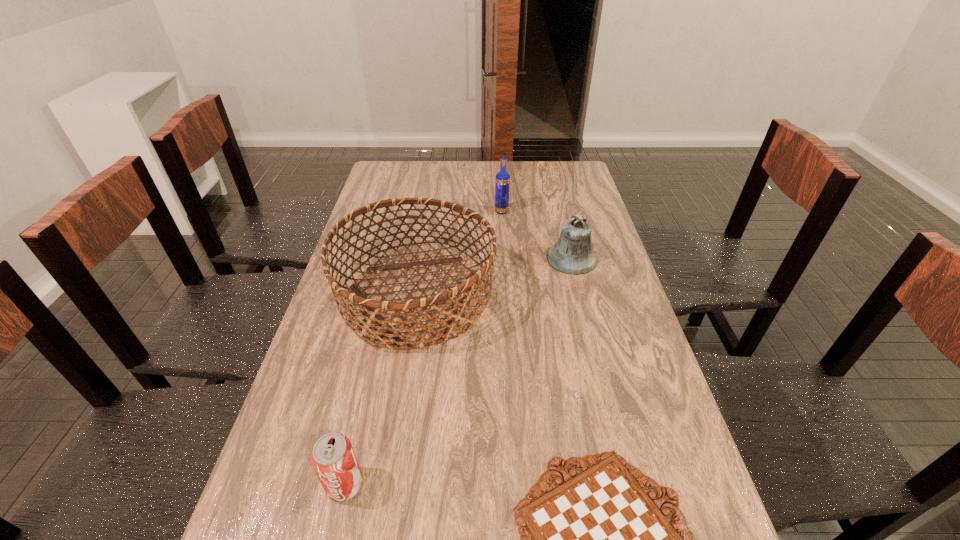
Find the location of `object positioned at the right edge`. object positioned at the right edge is located at coordinates (572, 254).

The height and width of the screenshot is (540, 960). In the image, there is a desktop. In order to click on vacant space at the far edge in this screenshot , I will do click(450, 164).

At what (x,y) coordinates should I click in order to perform the action: click on free spot at the left edge of the desktop. Please return your answer as a coordinate pair (x, y). Looking at the image, I should click on (343, 382).

Where is `vacant space at the right edge of the desktop`? vacant space at the right edge of the desktop is located at coordinates (645, 343).

You are a GUI agent. You are given a task and a screenshot of the screen. Output one action in this format:
    pyautogui.click(x=<x>, y=<y>)
    Task: Click on the vacant space at the far left corner
    The image size is (960, 540).
    Given the screenshot: What is the action you would take?
    pyautogui.click(x=397, y=184)

Where is `vacant area that lies between the bell and the farthest object`? The height and width of the screenshot is (540, 960). vacant area that lies between the bell and the farthest object is located at coordinates (537, 235).

Image resolution: width=960 pixels, height=540 pixels. Find the location of `free point between the bell and the soda can`. free point between the bell and the soda can is located at coordinates (458, 371).

The image size is (960, 540). Identify the location of unoccupied area between the soda can and the basket. (380, 390).

Where is `unoccupied position between the basket and the soda can`? The image size is (960, 540). unoccupied position between the basket and the soda can is located at coordinates (380, 390).

Identify the location of the closest object to the bell. This screenshot has height=540, width=960. (376, 310).